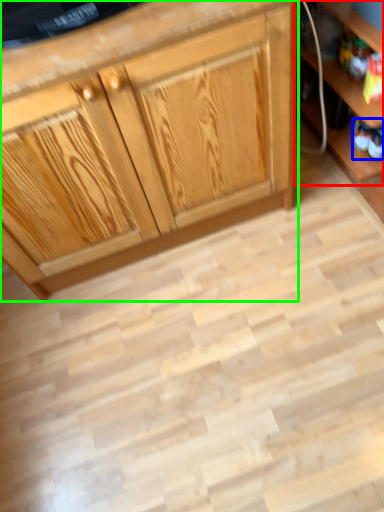
Question: Which is nearer to the shelf (highlighted by a red box)? toy (highlighted by a blue box) or cabinetry (highlighted by a green box).

Choices:
 (A) toy
 (B) cabinetry

Answer: (A)